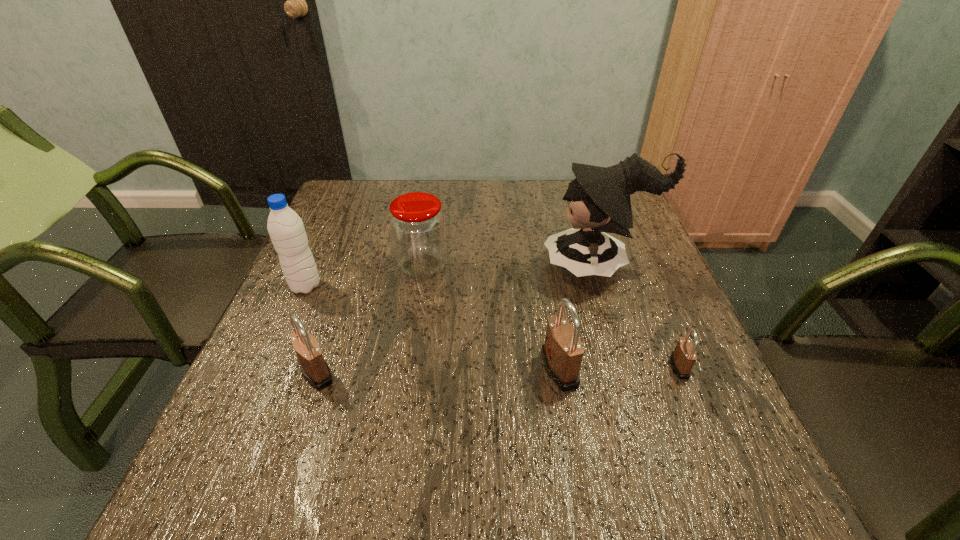
Locate an element on the screen. free spot between the water bottle and the fifth tallest object is located at coordinates (311, 329).

The width and height of the screenshot is (960, 540). What are the coordinates of `vacant region between the second padlock from left to right and the tallest object` in the screenshot? It's located at (579, 317).

This screenshot has width=960, height=540. I want to click on free space between the second tallest padlock and the second padlock from right to left, so click(x=438, y=370).

At what (x,y) coordinates should I click in order to perform the action: click on free space between the leftmost padlock and the shortest padlock. Please return your answer as a coordinate pair (x, y). Looking at the image, I should click on (x=498, y=369).

The image size is (960, 540). I want to click on free space that is in between the second padlock from left to right and the fifth object from right to left, so click(438, 370).

The height and width of the screenshot is (540, 960). What are the coordinates of `free space that is in between the second object from left to right and the shortest padlock` in the screenshot? It's located at tap(498, 369).

The height and width of the screenshot is (540, 960). Find the location of `the fourth closest object to the fifth tallest object`. the fourth closest object to the fifth tallest object is located at coordinates (598, 198).

At what (x,y) coordinates should I click in order to perform the action: click on the second closest object to the third object from left to right. Please return your answer as a coordinate pair (x, y). This screenshot has width=960, height=540. Looking at the image, I should click on (315, 370).

Locate an element on the screen. This screenshot has width=960, height=540. padlock that is the second closest to the second object from left to right is located at coordinates (683, 358).

This screenshot has height=540, width=960. In order to click on padlock that stands as the third closest to the jar in this screenshot , I will do `click(683, 358)`.